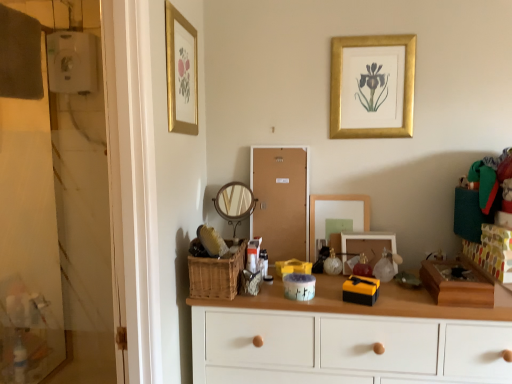
This screenshot has width=512, height=384. Find the location of `gold metallic picture frame at upper center, which is the 1th picture frame in right-to-left order`. gold metallic picture frame at upper center, which is the 1th picture frame in right-to-left order is located at coordinates (372, 86).

Where is `translucent plastic container at center`? Image resolution: width=512 pixels, height=384 pixels. translucent plastic container at center is located at coordinates (263, 263).

What do you see at coordinates (263, 263) in the screenshot?
I see `translucent plastic container at center` at bounding box center [263, 263].

Image resolution: width=512 pixels, height=384 pixels. Find the location of `wooden round mirror at center, acting as the second mirror starting from the right`. wooden round mirror at center, acting as the second mirror starting from the right is located at coordinates (234, 203).

In order to face corkboard at center, should I rotate leftwards or rightwards?

To align with it, rotate right about 3.349°.

Identify the location of gold metallic picture frame at upper center, placed as the third picture frame when sorted from left to right. (372, 86).

From a real-world perspective, is wooden round mirror at center, acting as the second mirror starting from the right, below matte glass mirror at center, which ranks as the 1th mirror in right-to-left order?

No, from a real-world perspective, wooden round mirror at center, acting as the second mirror starting from the right, is not below matte glass mirror at center, which ranks as the 1th mirror in right-to-left order.

Which is behind, wooden round mirror at center, placed as the 1th mirror when sorted from left to right, or matte glass mirror at center, placed as the second mirror when sorted from left to right?

wooden round mirror at center, placed as the 1th mirror when sorted from left to right.

Who is shorter, wooden round mirror at center, placed as the 1th mirror when sorted from left to right, or matte glass mirror at center, which ranks as the 1th mirror in right-to-left order?

With less height is matte glass mirror at center, which ranks as the 1th mirror in right-to-left order.

In the scene shown: From a real-world perspective, which is physically below, wooden picture frame at center, marked as the 1th picture frame in a bottom-to-top arrangement, or white wood chest of drawers at center?

white wood chest of drawers at center is physically lower.

How distant is wooden picture frame at center, which is the third picture frame from top to bottom, from white wood chest of drawers at center?

Answer: The distance of wooden picture frame at center, which is the third picture frame from top to bottom, from white wood chest of drawers at center is 16.23 inches.

From the image's perspective, is wooden picture frame at center, marked as the 1th picture frame in a bottom-to-top arrangement, below white wood chest of drawers at center?

No.

Who is taller, wooden picture frame at center, marked as the 1th picture frame in a bottom-to-top arrangement, or white wood chest of drawers at center?

white wood chest of drawers at center.

From a real-world perspective, which object stands above the other?

gold metallic picture frame at upper center, the 3th picture frame positioned from the bottom, is physically above.

From the image's perspective, is matte glass mirror at center, which ranks as the 1th mirror in right-to-left order, beneath gold metallic picture frame at upper center, the 3th picture frame positioned from the bottom?

Indeed, from the image's perspective, matte glass mirror at center, which ranks as the 1th mirror in right-to-left order, is shown beneath gold metallic picture frame at upper center, the 3th picture frame positioned from the bottom.

Considering the positions of points (314, 259) and (333, 135), is point (314, 259) farther from camera compared to point (333, 135)?

Yes, point (314, 259) is behind point (333, 135).

Is matte glass mirror at center, which ranks as the 1th mirror in right-to-left order, oriented away from gold metallic picture frame at upper center, acting as the 1th picture frame starting from the top?

No, matte glass mirror at center, which ranks as the 1th mirror in right-to-left order, is not facing the opposite direction of gold metallic picture frame at upper center, acting as the 1th picture frame starting from the top.

Is corkboard at center shorter than gold framed print at upper left, the 2th picture frame positioned from the bottom?

No.

Identify the location of picture frame on the left of corkboard at center. (181, 72).

From a real-world perspective, is corkboard at center under gold framed print at upper left, the 2th picture frame viewed from the top?

Yes.

Between point (260, 168) and point (167, 62), which one is positioned behind?

The point (260, 168) is farther.

How distant is matte glass mirror at center, placed as the second mirror when sorted from left to right, from shiny metallic toy at center?

matte glass mirror at center, placed as the second mirror when sorted from left to right, is 8.29 inches from shiny metallic toy at center.

Consider the image. Considering the relative sizes of matte glass mirror at center, placed as the second mirror when sorted from left to right, and shiny metallic toy at center in the image provided, is matte glass mirror at center, placed as the second mirror when sorted from left to right, thinner than shiny metallic toy at center?

No.

From the image's perspective, is matte glass mirror at center, placed as the second mirror when sorted from left to right, above or below shiny metallic toy at center?

Based on their image positions, matte glass mirror at center, placed as the second mirror when sorted from left to right, is located above shiny metallic toy at center.

Consider the image. Between matte glass mirror at center, which ranks as the 1th mirror in right-to-left order, and shiny metallic toy at center, which one has larger size?

matte glass mirror at center, which ranks as the 1th mirror in right-to-left order.

From a real-world perspective, which object stands above the other?

translucent plastic container at center is physically above.

The height and width of the screenshot is (384, 512). I want to click on box on the right of translucent plastic container at center, so click(456, 284).

Based on the photo, is wooden box at right to the left of translucent plastic container at center from the viewer's perspective?

No.

From a real-world perspective, is wooden round mirror at center, placed as the 1th mirror when sorted from left to right, below gold framed print at upper left, the 2th picture frame positioned from the bottom?

Yes, from a real-world perspective, wooden round mirror at center, placed as the 1th mirror when sorted from left to right, is below gold framed print at upper left, the 2th picture frame positioned from the bottom.

Which of these two, wooden round mirror at center, placed as the 1th mirror when sorted from left to right, or gold framed print at upper left, which appears as the first picture frame when viewed from the left, is thinner?

gold framed print at upper left, which appears as the first picture frame when viewed from the left.

Does point (215, 207) come closer to viewer compared to point (169, 86)?

No.

Is wooden round mirror at center, acting as the second mirror starting from the right, oriented away from gold framed print at upper left, which appears as the first picture frame when viewed from the left?

No, gold framed print at upper left, which appears as the first picture frame when viewed from the left, is not at the back of wooden round mirror at center, acting as the second mirror starting from the right.

At what (x,y) coordinates should I click in order to perform the action: click on mirror lying below the wooden round mirror at center, acting as the second mirror starting from the right (from the image's perspective). Please return your answer as a coordinate pair (x, y). Image resolution: width=512 pixels, height=384 pixels. Looking at the image, I should click on (336, 215).

Find the location of a particular element. This screenshot has height=384, width=512. the 2nd picture frame behind when counting from the white wood chest of drawers at center is located at coordinates (366, 245).

Based on their spatial positions, is woven brown basket at center or corkboard at center closer to gold framed print at upper left, the 2th picture frame positioned from the bottom?

Among the two, corkboard at center is located nearer to gold framed print at upper left, the 2th picture frame positioned from the bottom.

Considering their positions, is gold framed print at upper left, which appears as the first picture frame when viewed from the left, positioned further to translucent plastic container at center than woven brown basket at center?

The object further to translucent plastic container at center is gold framed print at upper left, which appears as the first picture frame when viewed from the left.

When comparing their distances from gold framed print at upper left, the 2th picture frame positioned from the bottom, does matte glass mirror at center, placed as the second mirror when sorted from left to right, or wooden box at right seem further?

The object further to gold framed print at upper left, the 2th picture frame positioned from the bottom, is wooden box at right.

From the image, which object appears to be nearer to shiny metallic toy at center, wooden round mirror at center, placed as the 1th mirror when sorted from left to right, or translucent plastic container at center?

Answer: translucent plastic container at center is closer to shiny metallic toy at center.

Considering their positions, is gold metallic picture frame at upper center, the 3th picture frame positioned from the bottom, positioned further to wooden box at right than matte glass mirror at center, which ranks as the 1th mirror in right-to-left order?

gold metallic picture frame at upper center, the 3th picture frame positioned from the bottom, lies further to wooden box at right than the other object.

Considering their positions, is shiny metallic toy at center positioned further to woven brown basket at center than gold metallic picture frame at upper center, acting as the 1th picture frame starting from the top?

gold metallic picture frame at upper center, acting as the 1th picture frame starting from the top, is positioned further to the anchor woven brown basket at center.

When comparing their distances from corkboard at center, does wooden box at right or wooden picture frame at center, marked as the 1th picture frame in a bottom-to-top arrangement, seem further?

wooden box at right.

Considering their positions, is wooden picture frame at center, the 2th picture frame from the left, positioned closer to matte glass mirror at center, which ranks as the 1th mirror in right-to-left order, than corkboard at center?

wooden picture frame at center, the 2th picture frame from the left, is closer to matte glass mirror at center, which ranks as the 1th mirror in right-to-left order.

Locate an element on the screen. This screenshot has height=384, width=512. toiletry between woven brown basket at center and shiny metallic toy at center is located at coordinates (263, 263).

The image size is (512, 384). I want to click on toiletry situated between wooden round mirror at center, placed as the 1th mirror when sorted from left to right, and wooden picture frame at center, which is counted as the 2th picture frame, starting from the right, from left to right, so click(263, 263).

Where is `screen door between gold metallic picture frame at upper center, acting as the 1th picture frame starting from the top, and translucent plastic container at center from top to bottom`? The height and width of the screenshot is (384, 512). screen door between gold metallic picture frame at upper center, acting as the 1th picture frame starting from the top, and translucent plastic container at center from top to bottom is located at coordinates (x=280, y=201).

The image size is (512, 384). Identify the location of toiletry between gold framed print at upper left, arranged as the 3th picture frame when viewed from the right, and white wood chest of drawers at center vertically. (263, 263).